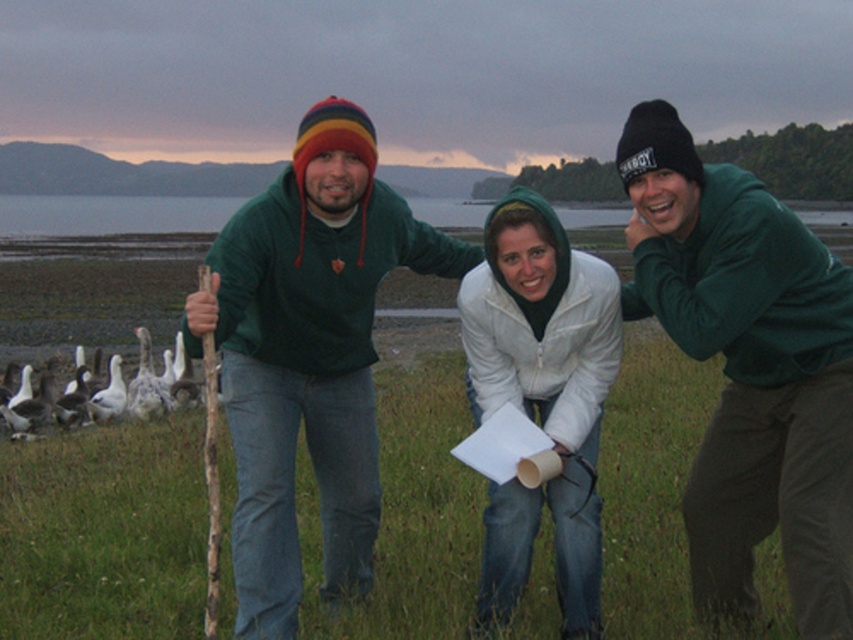
You are standing in the scene and want to hand a scarf to the person wearing the matte green hoodie at center. Which direction should you walk to reach them from the green woolen sweater at center?

The matte green hoodie at center is to the right of the green woolen sweater at center, so you should walk to the right to reach the matte green hoodie at center.

Please look at the image. There is a point at coordinate (308, 356). The green woolen sweater at center is part of the scene. Is the point located on the green woolen sweater at center?

Yes, the point at coordinate (308, 356) is located on the green woolen sweater at center according to the provided description.